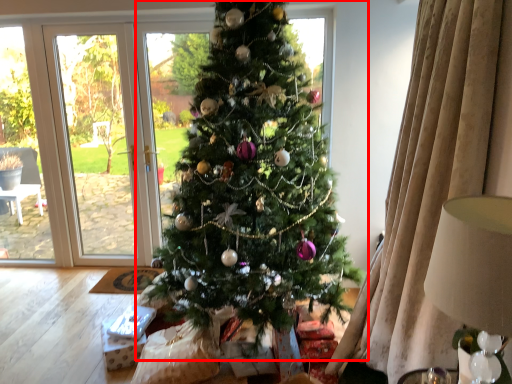
Question: From the image, what is the correct spatial relationship of christmas tree (annotated by the red box) in relation to lamp?

Choices:
 (A) right
 (B) left

Answer: (B)